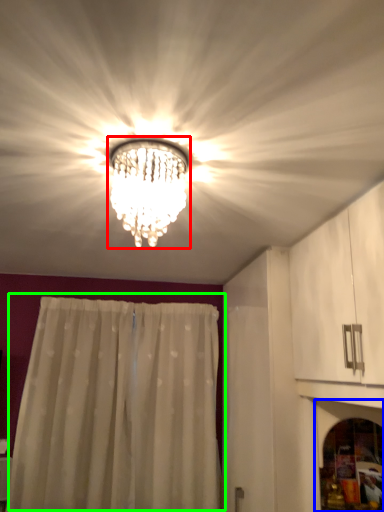
Question: Which object is positioned closest to lamp (highlighted by a red box)? Select from screen door (highlighted by a blue box) and curtain (highlighted by a green box).

Choices:
 (A) screen door
 (B) curtain

Answer: (A)